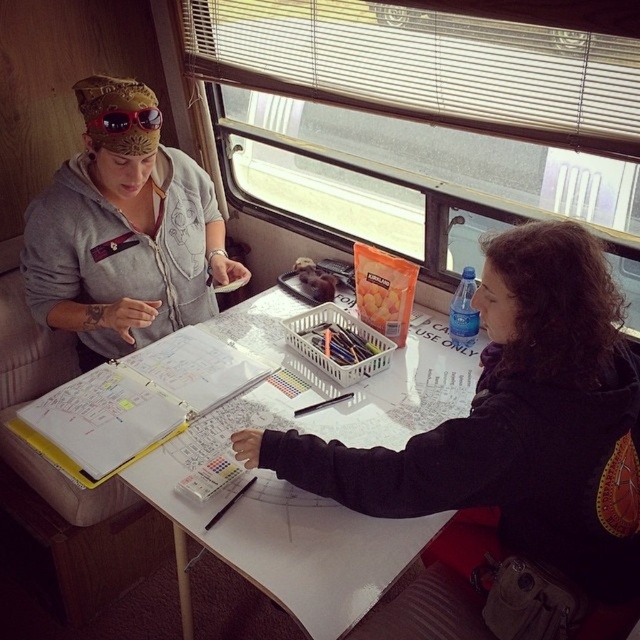
Consider the image. Can you confirm if matte gray hoodie at upper left is positioned to the right of matte plastic ruler at center?

Incorrect, matte gray hoodie at upper left is not on the right side of matte plastic ruler at center.

Locate an element on the screen. The width and height of the screenshot is (640, 640). matte gray hoodie at upper left is located at coordinates (124, 244).

The height and width of the screenshot is (640, 640). Identify the location of matte gray hoodie at upper left. (124, 244).

Can you confirm if black matte hoodie at center is shorter than matte plastic ruler at center?

No.

Is point (248, 442) closer to camera compared to point (243, 488)?

That is True.

Locate an element on the screen. Image resolution: width=640 pixels, height=640 pixels. black matte hoodie at center is located at coordinates (515, 420).

Is the position of white paper at center less distant than that of red plastic sunglasses at upper left?

Yes, it is in front of red plastic sunglasses at upper left.

Between point (417, 333) and point (102, 129), which one is positioned in front?

Point (102, 129) is more forward.

The height and width of the screenshot is (640, 640). I want to click on white paper at center, so click(305, 492).